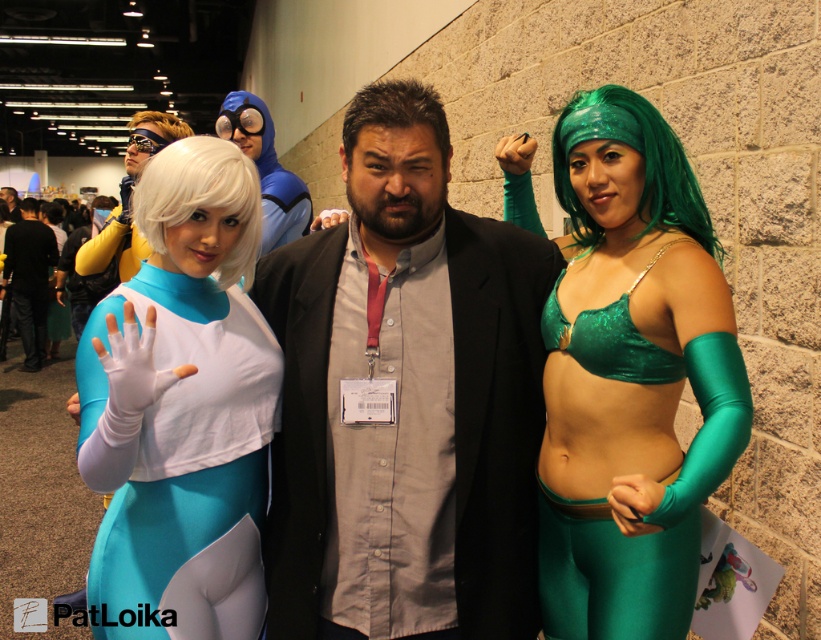
The image size is (821, 640). Describe the element at coordinates (586, 348) in the screenshot. I see `matte white wig at upper left` at that location.

Image resolution: width=821 pixels, height=640 pixels. Describe the element at coordinates (586, 348) in the screenshot. I see `matte white wig at upper left` at that location.

Where is `matte white wig at upper left`? matte white wig at upper left is located at coordinates (586, 348).

Does matte black suit at center lie in front of blonde wig at upper left?

That is False.

Does matte black suit at center have a lesser width compared to blonde wig at upper left?

Correct, matte black suit at center's width is less than blonde wig at upper left's.

Where is `matte black suit at center`? This screenshot has height=640, width=821. matte black suit at center is located at coordinates (30, 278).

Where is `matte black suit at center`? matte black suit at center is located at coordinates (30, 278).

Between point (416, 96) and point (345, 122), which one is positioned behind?

The point (345, 122) is behind.

Which of these two, gray fabric shirt at center or dark brown hair at center, stands taller?

gray fabric shirt at center is taller.

Is point (416, 502) positioned after point (416, 102)?

Yes, it is.

What are the coordinates of `gray fabric shirt at center` in the screenshot? It's located at (406, 400).